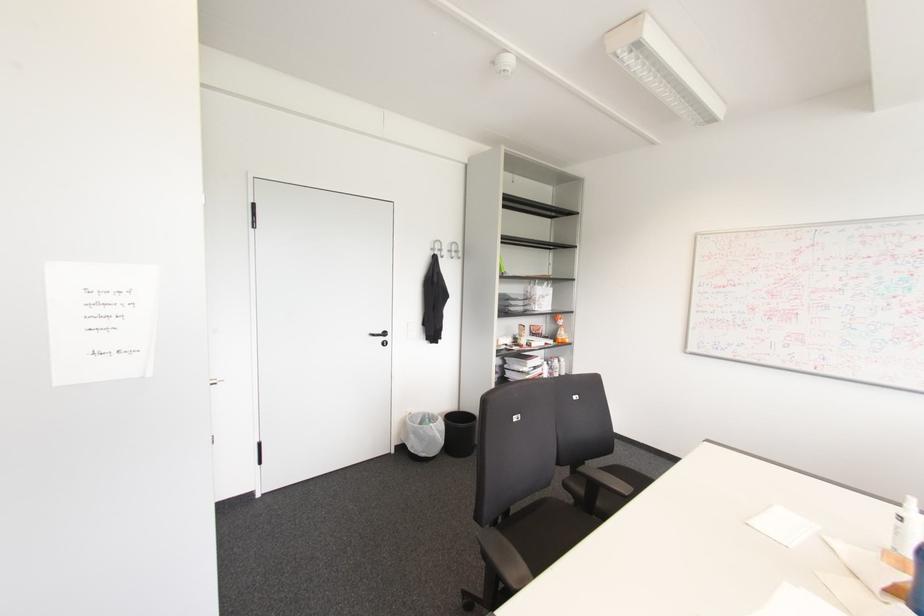
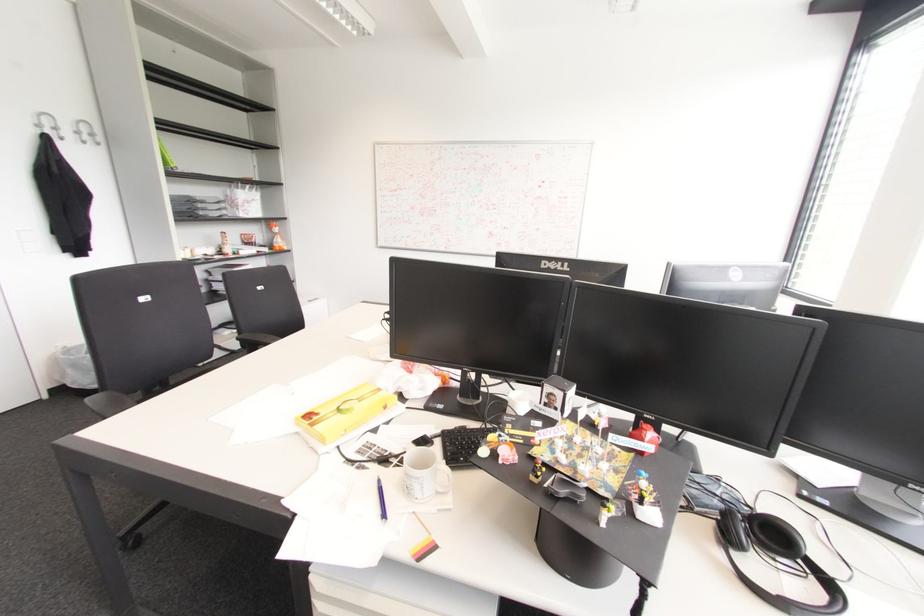
Question: The images are taken continuously from a first-person perspective. In which direction is your viewpoint rotating?

Choices:
 (A) Left
 (B) Right
 (C) Up
 (D) Down

Answer: (B)